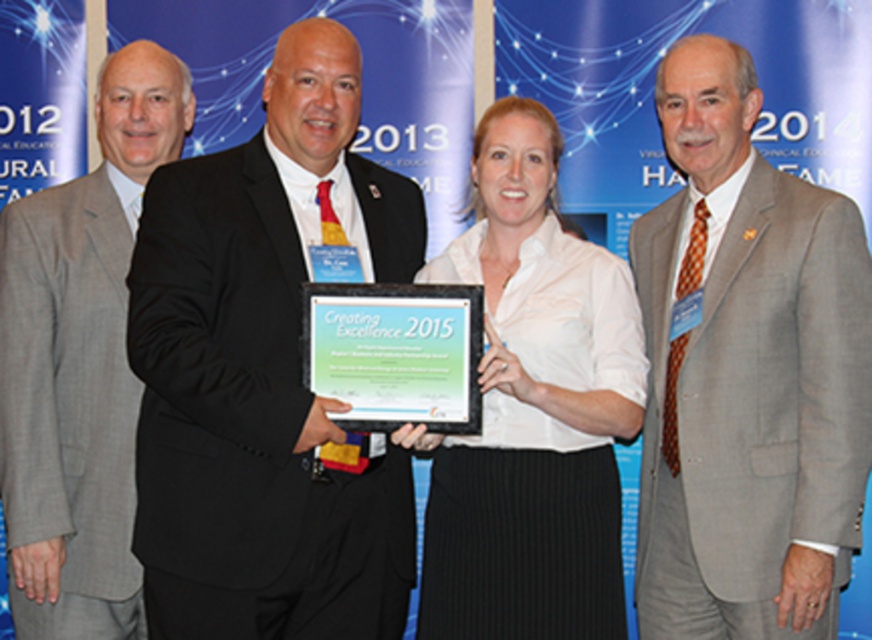
Question: Which point is closer to the camera?

Choices:
 (A) white matte shirt at center
 (B) gray wool suit at center
 (C) gray suit at left

Answer: (A)

Question: Is black suit at center positioned before green matte plaque at center?

Choices:
 (A) yes
 (B) no

Answer: (A)

Question: Which is farther from the green matte plaque at center?

Choices:
 (A) white matte shirt at center
 (B) gray suit at left

Answer: (B)

Question: Which of the following is the farthest from the observer?

Choices:
 (A) white matte shirt at center
 (B) black suit at center
 (C) gray wool suit at center

Answer: (C)

Question: Does gray wool suit at center appear under white matte shirt at center?

Choices:
 (A) yes
 (B) no

Answer: (B)

Question: Is black suit at center below gray wool suit at center?

Choices:
 (A) yes
 (B) no

Answer: (B)